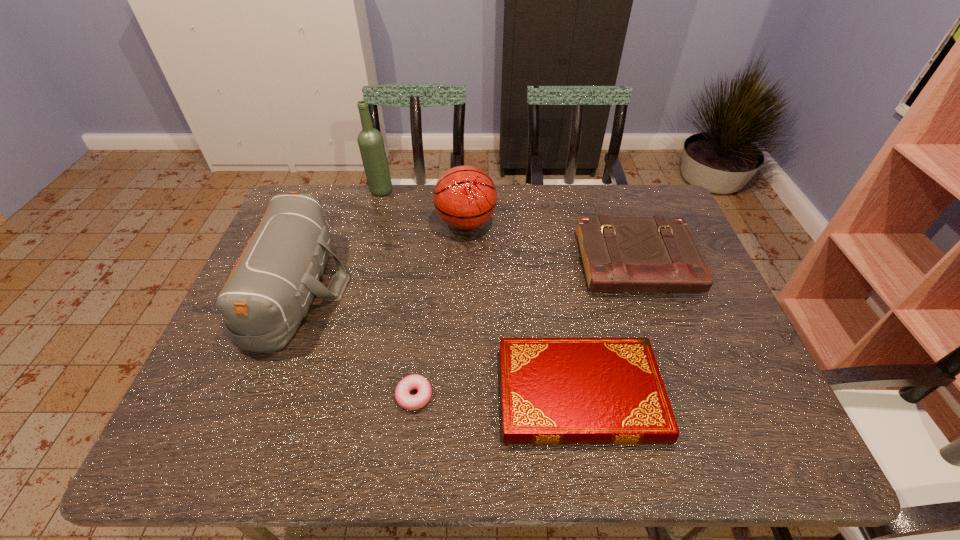
This screenshot has height=540, width=960. Find the location of `blank region between the basketball and the doughnut`. blank region between the basketball and the doughnut is located at coordinates (440, 309).

Locate an element on the screen. free spot between the taller hardback book and the duffel bag is located at coordinates (467, 275).

Locate an element on the screen. The width and height of the screenshot is (960, 540). free space between the shortest object and the taller hardback book is located at coordinates (525, 329).

Find the location of a particular element. The height and width of the screenshot is (540, 960). free spot between the farthest object and the basketball is located at coordinates (x=423, y=207).

The height and width of the screenshot is (540, 960). I want to click on vacant point located between the doughnut and the basketball, so click(440, 309).

Locate an element on the screen. empty space that is in between the tallest object and the duffel bag is located at coordinates (339, 239).

Locate an element on the screen. The width and height of the screenshot is (960, 540). blank region between the doughnut and the duffel bag is located at coordinates (356, 342).

At what (x,y) coordinates should I click in order to perform the action: click on object that is the second closest to the shorter hardback book. Please return your answer as a coordinate pair (x, y). This screenshot has width=960, height=540. Looking at the image, I should click on (619, 254).

Find the location of `the third closest object to the farther hardback book`. the third closest object to the farther hardback book is located at coordinates (403, 397).

The image size is (960, 540). Find the location of `free space that satisfies the following two spatial constraints: 1. on the back side of the taller hardback book; 2. on the side with spill of the basketball`. free space that satisfies the following two spatial constraints: 1. on the back side of the taller hardback book; 2. on the side with spill of the basketball is located at coordinates (622, 223).